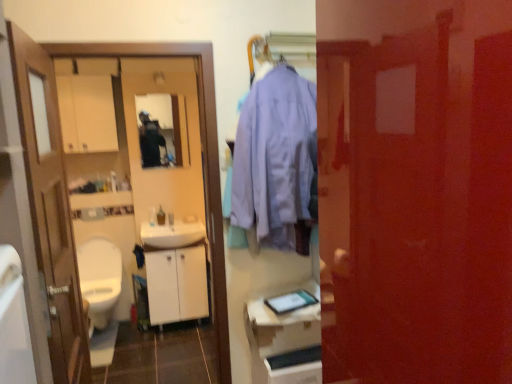
Question: Does white glossy sink at center touch white matte cabinet at center, positioned as the first cabinetry in back-to-front order?

Choices:
 (A) yes
 (B) no

Answer: (B)

Question: From the image's perspective, is white glossy sink at center over white matte cabinet at center, the 2th cabinetry viewed from the right?

Choices:
 (A) yes
 (B) no

Answer: (A)

Question: From a real-world perspective, is white glossy sink at center physically above white matte cabinet at center, marked as the first cabinetry in a left-to-right arrangement?

Choices:
 (A) no
 (B) yes

Answer: (B)

Question: Does white glossy sink at center have a greater width compared to white matte cabinet at center, the 2th cabinetry viewed from the right?

Choices:
 (A) no
 (B) yes

Answer: (B)

Question: Can you confirm if white glossy sink at center is positioned to the left of white matte cabinet at center, marked as the first cabinetry in a left-to-right arrangement?

Choices:
 (A) no
 (B) yes

Answer: (B)

Question: Is white glossy sink at center oriented away from white matte cabinet at center, positioned as the first cabinetry in back-to-front order?

Choices:
 (A) no
 (B) yes

Answer: (A)

Question: Considering the relative sizes of white glossy sink at center and white glossy cabinet at lower center, acting as the 1th cabinetry starting from the front, in the image provided, is white glossy sink at center bigger than white glossy cabinet at lower center, acting as the 1th cabinetry starting from the front,?

Choices:
 (A) yes
 (B) no

Answer: (B)

Question: From the image's perspective, is white glossy sink at center on white glossy cabinet at lower center, which ranks as the first cabinetry in right-to-left order?

Choices:
 (A) yes
 (B) no

Answer: (A)

Question: Is white glossy sink at center aimed at white glossy cabinet at lower center, which is the 2th cabinetry from left to right?

Choices:
 (A) no
 (B) yes

Answer: (B)

Question: From a real-world perspective, is white glossy sink at center located beneath white glossy cabinet at lower center, which is the 2th cabinetry from left to right?

Choices:
 (A) no
 (B) yes

Answer: (A)

Question: Is white glossy sink at center taller than white glossy cabinet at lower center, which ranks as the first cabinetry in right-to-left order?

Choices:
 (A) no
 (B) yes

Answer: (A)

Question: Is white glossy sink at center wider than white glossy cabinet at lower center, the 2th cabinetry positioned from the back?

Choices:
 (A) no
 (B) yes

Answer: (A)

Question: Does matte black tablet at center have a larger size compared to white matte cabinet at center, the 2th cabinetry viewed from the right?

Choices:
 (A) yes
 (B) no

Answer: (B)